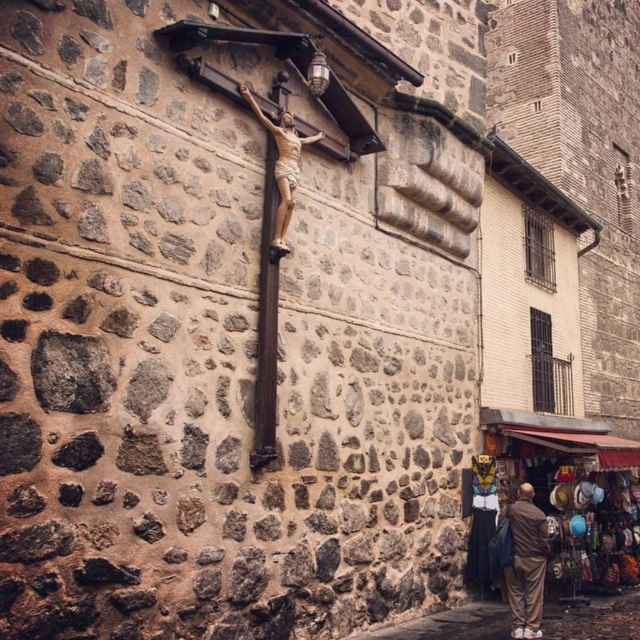
Does brown fabric pants at lower right have a greater width compared to wooden crucifix at center?

Indeed, brown fabric pants at lower right has a greater width compared to wooden crucifix at center.

Is point (522, 538) less distant than point (292, 180)?

No, it is behind (292, 180).

Describe the element at coordinates (525, 563) in the screenshot. The image size is (640, 640). I see `brown fabric pants at lower right` at that location.

Where is `brown fabric pants at lower right`? The height and width of the screenshot is (640, 640). brown fabric pants at lower right is located at coordinates (525, 563).